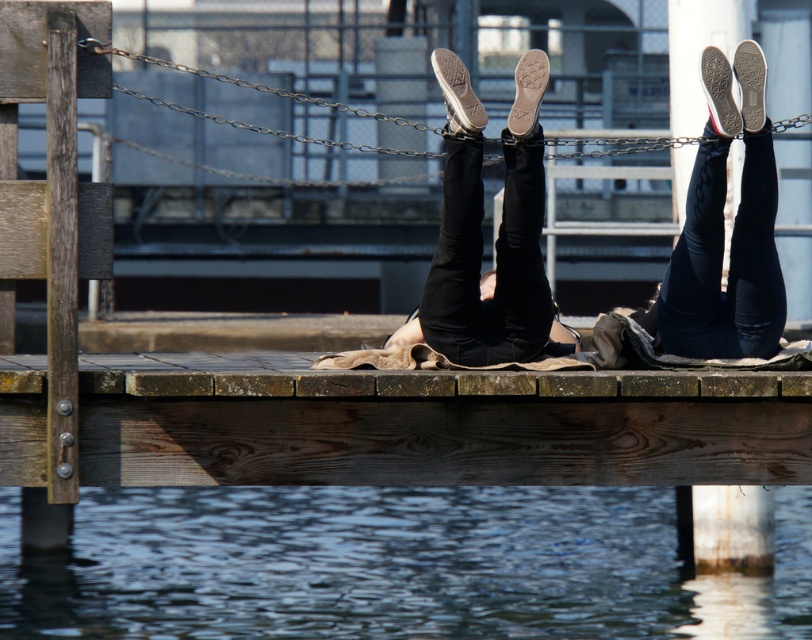
Does clear water at lower center appear on the left side of matte black jeans at center?

Indeed, clear water at lower center is positioned on the left side of matte black jeans at center.

Is clear water at lower center further to camera compared to matte black jeans at center?

Yes, clear water at lower center is further from the viewer.

The width and height of the screenshot is (812, 640). What do you see at coordinates (391, 564) in the screenshot? I see `clear water at lower center` at bounding box center [391, 564].

Identify the location of clear water at lower center. This screenshot has height=640, width=812. (391, 564).

The height and width of the screenshot is (640, 812). I want to click on clear water at lower center, so tap(391, 564).

Is clear water at lower center above matte black leggings at center?

Actually, clear water at lower center is below matte black leggings at center.

Who is more forward, (94,506) or (772,333)?

Positioned in front is point (772,333).

Where is `clear water at lower center`? clear water at lower center is located at coordinates (391, 564).

Who is positioned more to the left, matte black jeans at center or matte black leggings at center?

Positioned to the left is matte black jeans at center.

How distant is matte black jeans at center from matte black leggings at center?

23.02 inches

Which is in front, point (523, 152) or point (702, 273)?

Point (523, 152) is more forward.

This screenshot has width=812, height=640. In order to click on matte black jeans at center in this screenshot , I will do `click(482, 234)`.